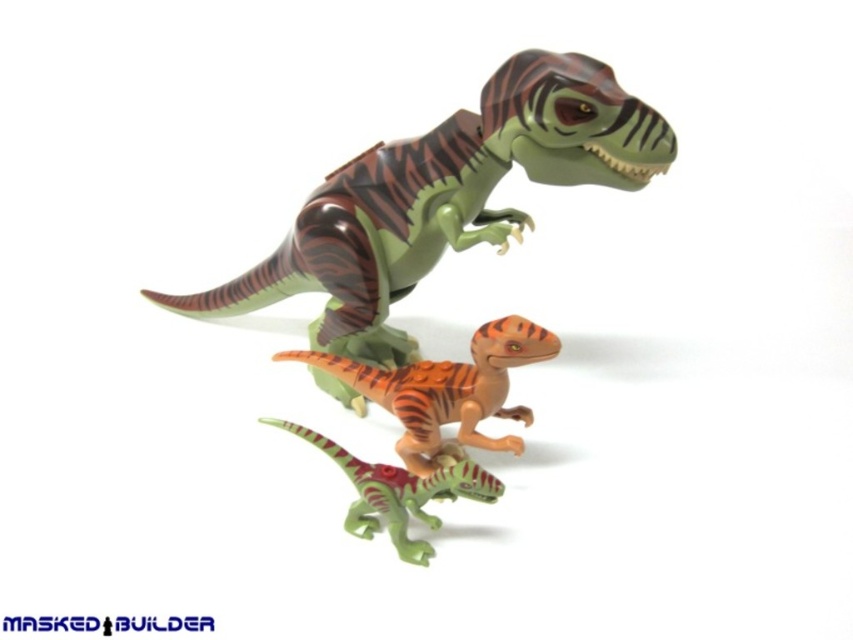
Is point (360, 316) positioned behind point (401, 499)?

Yes.

Between point (480, 204) and point (466, 472), which one is positioned behind?

Positioned behind is point (480, 204).

You are a GUI agent. You are given a task and a screenshot of the screen. Output one action in this format:
    pyautogui.click(x=<x>, y=<y>)
    Task: Click on the green matte tyrannosaurus rex at center
    
    Given the screenshot: What is the action you would take?
    pyautogui.click(x=444, y=198)

Which is more to the right, green matte tyrannosaurus rex at center or orange-brown striped dinosaur at center?

orange-brown striped dinosaur at center is more to the right.

Is green matte tyrannosaurus rex at center positioned behind orange-brown striped dinosaur at center?

No, it is not.

Between point (369, 342) and point (485, 444), which one is positioned in front?

Point (485, 444) is in front.

Find the location of a particular element. The width and height of the screenshot is (853, 640). green matte tyrannosaurus rex at center is located at coordinates (444, 198).

Does orange-brown striped dinosaur at center have a greater height compared to green matte dinosaur at center?

Correct, orange-brown striped dinosaur at center is much taller as green matte dinosaur at center.

Does point (440, 364) come behind point (340, 465)?

Yes, point (440, 364) is farther from viewer.

At what (x,y) coordinates should I click in order to perform the action: click on orange-brown striped dinosaur at center. Please return your answer as a coordinate pair (x, y). The image size is (853, 640). Looking at the image, I should click on (445, 388).